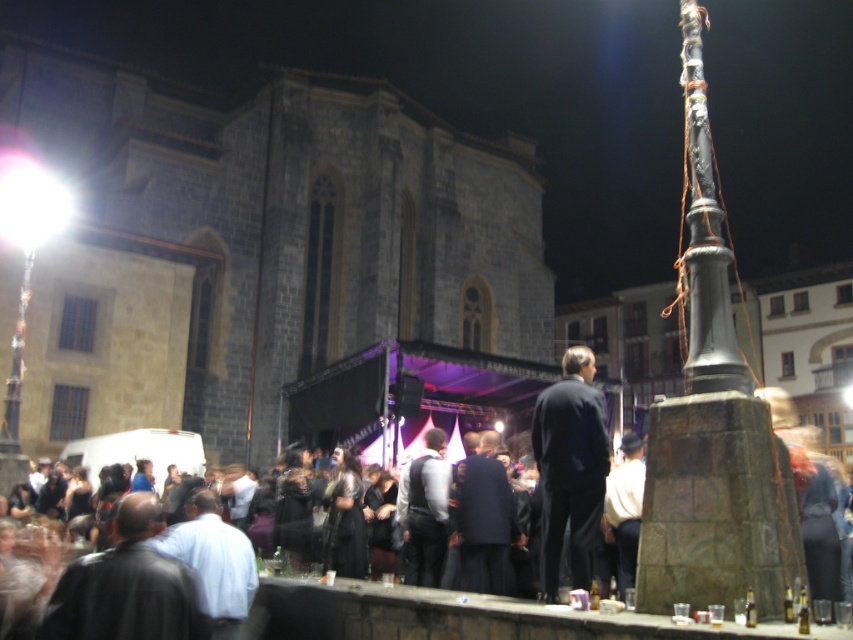
Question: Is dark gray stone church at upper left above dark suit at center?

Choices:
 (A) yes
 (B) no

Answer: (A)

Question: Does black suit at center come behind white cotton shirt at center?

Choices:
 (A) yes
 (B) no

Answer: (B)

Question: Estimate the real-world distances between objects in this image. Which object is closer to the black leather jacket at lower left?

Choices:
 (A) dark gray stone church at upper left
 (B) white cotton shirt at center
 (C) polished metal pole at right
 (D) dark gray suit at center

Answer: (D)

Question: Which is nearer to the dark gray stone church at upper left?

Choices:
 (A) polished metal pole at right
 (B) dark gray suit at center
 (C) black suit at center
 (D) dark suit at center

Answer: (C)

Question: In this image, where is black leather jacket at lower left located relative to white cotton shirt at center?

Choices:
 (A) right
 (B) left

Answer: (B)

Question: Which object is positioned farthest from the dark gray suit at center?

Choices:
 (A) black suit at center
 (B) dark suit at center
 (C) white cotton shirt at center
 (D) black leather jacket at lower left

Answer: (D)